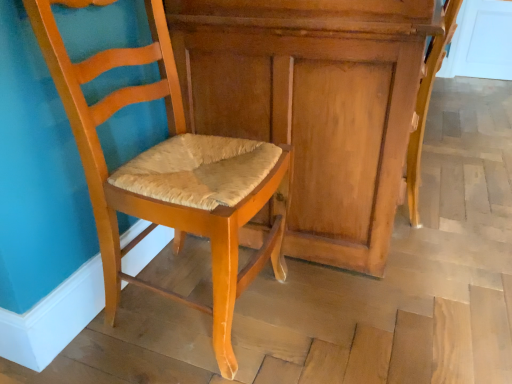
Where is `matte wood chair at center, the second chair viewed from the right`? The width and height of the screenshot is (512, 384). matte wood chair at center, the second chair viewed from the right is located at coordinates (146, 196).

The width and height of the screenshot is (512, 384). What do you see at coordinates (313, 105) in the screenshot? I see `wooden dresser at center` at bounding box center [313, 105].

This screenshot has height=384, width=512. Describe the element at coordinates (426, 105) in the screenshot. I see `light brown wood chair at lower right, which is the second chair in left-to-right order` at that location.

This screenshot has height=384, width=512. What are the coordinates of `matte wood chair at center, the second chair viewed from the right` in the screenshot? It's located at (146, 196).

I want to click on dresser located underneath the matte wood chair at center, the second chair viewed from the right (from a real-world perspective), so click(313, 105).

Is wooden dresser at center beside matte wood chair at center, placed as the 1th chair when sorted from left to right?

No.

Which is correct: wooden dresser at center is inside matte wood chair at center, the second chair viewed from the right, or outside of it?

wooden dresser at center is located beyond the bounds of matte wood chair at center, the second chair viewed from the right.

Can you confirm if wooden dresser at center is smaller than matte wood chair at center, placed as the 1th chair when sorted from left to right?

No.

Is matte wood chair at center, the second chair viewed from the right, surrounding light brown wood chair at lower right, which is the second chair in left-to-right order?

Actually, light brown wood chair at lower right, which is the second chair in left-to-right order, is outside matte wood chair at center, the second chair viewed from the right.

Is matte wood chair at center, placed as the 1th chair when sorted from left to right, further to camera compared to light brown wood chair at lower right, arranged as the first chair when viewed from the right?

No, matte wood chair at center, placed as the 1th chair when sorted from left to right, is closer to the camera.

Is light brown wood chair at lower right, arranged as the first chair when viewed from the right, at the back of matte wood chair at center, the second chair viewed from the right?

No, light brown wood chair at lower right, arranged as the first chair when viewed from the right, is not at the back of matte wood chair at center, the second chair viewed from the right.

From a real-world perspective, is matte wood chair at center, placed as the 1th chair when sorted from left to right, on light brown wood chair at lower right, which is the second chair in left-to-right order?

Yes, from a real-world perspective, matte wood chair at center, placed as the 1th chair when sorted from left to right, is over light brown wood chair at lower right, which is the second chair in left-to-right order

At what (x,y) coordinates should I click in order to perform the action: click on dresser that appears above the light brown wood chair at lower right, arranged as the first chair when viewed from the right (from the image's perspective). Please return your answer as a coordinate pair (x, y). Looking at the image, I should click on click(313, 105).

Are wooden dresser at center and light brown wood chair at lower right, which is the second chair in left-to-right order, far apart?

No.

Between wooden dresser at center and light brown wood chair at lower right, arranged as the first chair when viewed from the right, which one has smaller size?

light brown wood chair at lower right, arranged as the first chair when viewed from the right.

Considering the points (266, 65) and (415, 136), which point is behind, point (266, 65) or point (415, 136)?

Point (415, 136)

Considering the relative positions of matte wood chair at center, placed as the 1th chair when sorted from left to right, and wooden dresser at center in the image provided, is matte wood chair at center, placed as the 1th chair when sorted from left to right, to the right of wooden dresser at center from the viewer's perspective?

No, matte wood chair at center, placed as the 1th chair when sorted from left to right, is not to the right of wooden dresser at center.

What's the angular difference between matte wood chair at center, the second chair viewed from the right, and wooden dresser at center's facing directions?

2.11 degrees.

Is wooden dresser at center at the back of matte wood chair at center, placed as the 1th chair when sorted from left to right?

No, matte wood chair at center, placed as the 1th chair when sorted from left to right,'s orientation is not away from wooden dresser at center.

In the scene shown: Is wooden dresser at center surrounded by matte wood chair at center, placed as the 1th chair when sorted from left to right?

Definitely not — wooden dresser at center is not inside matte wood chair at center, placed as the 1th chair when sorted from left to right.

Considering the relative sizes of light brown wood chair at lower right, which is the second chair in left-to-right order, and matte wood chair at center, placed as the 1th chair when sorted from left to right, in the image provided, is light brown wood chair at lower right, which is the second chair in left-to-right order, smaller than matte wood chair at center, placed as the 1th chair when sorted from left to right,?

Yes, light brown wood chair at lower right, which is the second chair in left-to-right order, is smaller than matte wood chair at center, placed as the 1th chair when sorted from left to right.

Consider the image. Does light brown wood chair at lower right, arranged as the first chair when viewed from the right, appear on the right side of matte wood chair at center, the second chair viewed from the right?

Yes.

How distant is light brown wood chair at lower right, arranged as the first chair when viewed from the right, from matte wood chair at center, placed as the 1th chair when sorted from left to right?

The distance of light brown wood chair at lower right, arranged as the first chair when viewed from the right, from matte wood chair at center, placed as the 1th chair when sorted from left to right, is 29.81 inches.

This screenshot has height=384, width=512. Identify the location of chair in front of the light brown wood chair at lower right, which is the second chair in left-to-right order. (146, 196).

Is light brown wood chair at lower right, arranged as the first chair when viewed from the right, facing away from wooden dresser at center?

Yes, wooden dresser at center is at the back of light brown wood chair at lower right, arranged as the first chair when viewed from the right.

Would you consider light brown wood chair at lower right, arranged as the first chair when viewed from the right, to be distant from wooden dresser at center?

No, light brown wood chair at lower right, arranged as the first chair when viewed from the right, is in close proximity to wooden dresser at center.

Is wooden dresser at center surrounded by light brown wood chair at lower right, arranged as the first chair when viewed from the right?

No.

From a real-world perspective, which object rests below the other?

In real-world perspective, light brown wood chair at lower right, which is the second chair in left-to-right order, is lower.

You are a GUI agent. You are given a task and a screenshot of the screen. Output one action in this format:
    pyautogui.click(x=<x>, y=<y>)
    Task: Click on the dresser located behind the matte wood chair at center, the second chair viewed from the right
    The width and height of the screenshot is (512, 384).
    Given the screenshot: What is the action you would take?
    pyautogui.click(x=313, y=105)

Locate an element on the screen. The height and width of the screenshot is (384, 512). chair on the right of the matte wood chair at center, placed as the 1th chair when sorted from left to right is located at coordinates (426, 105).

Looking at the image, which one is located further to wooden dresser at center, light brown wood chair at lower right, arranged as the first chair when viewed from the right, or matte wood chair at center, the second chair viewed from the right?

light brown wood chair at lower right, arranged as the first chair when viewed from the right, lies further to wooden dresser at center than the other object.

Considering their positions, is wooden dresser at center positioned further to light brown wood chair at lower right, which is the second chair in left-to-right order, than matte wood chair at center, the second chair viewed from the right?

The object further to light brown wood chair at lower right, which is the second chair in left-to-right order, is matte wood chair at center, the second chair viewed from the right.

Looking at the image, which one is located further to matte wood chair at center, the second chair viewed from the right, wooden dresser at center or light brown wood chair at lower right, arranged as the first chair when viewed from the right?

light brown wood chair at lower right, arranged as the first chair when viewed from the right, lies further to matte wood chair at center, the second chair viewed from the right, than the other object.

From the image, which object appears to be nearer to light brown wood chair at lower right, which is the second chair in left-to-right order, matte wood chair at center, the second chair viewed from the right, or wooden dresser at center?

wooden dresser at center.

When comparing their distances from matte wood chair at center, placed as the 1th chair when sorted from left to right, does light brown wood chair at lower right, which is the second chair in left-to-right order, or wooden dresser at center seem closer?

wooden dresser at center lies closer to matte wood chair at center, placed as the 1th chair when sorted from left to right, than the other object.

Based on their spatial positions, is matte wood chair at center, placed as the 1th chair when sorted from left to right, or light brown wood chair at lower right, arranged as the first chair when viewed from the right, closer to wooden dresser at center?

Among the two, matte wood chair at center, placed as the 1th chair when sorted from left to right, is located nearer to wooden dresser at center.

Locate an element on the screen. dresser located between matte wood chair at center, placed as the 1th chair when sorted from left to right, and light brown wood chair at lower right, which is the second chair in left-to-right order, in the left-right direction is located at coordinates (313, 105).